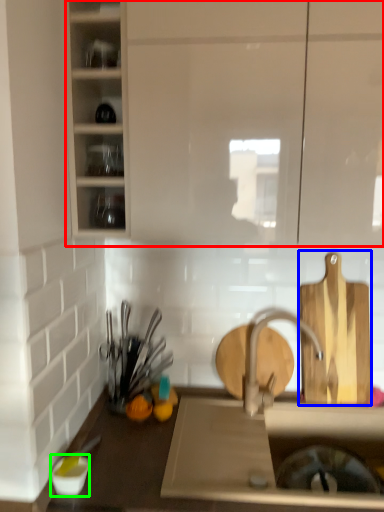
Question: Which object is the farthest from cabinetry (highlighted by a red box)? Choose among these: cutting board (highlighted by a blue box) or tableware (highlighted by a green box).

Choices:
 (A) cutting board
 (B) tableware

Answer: (B)